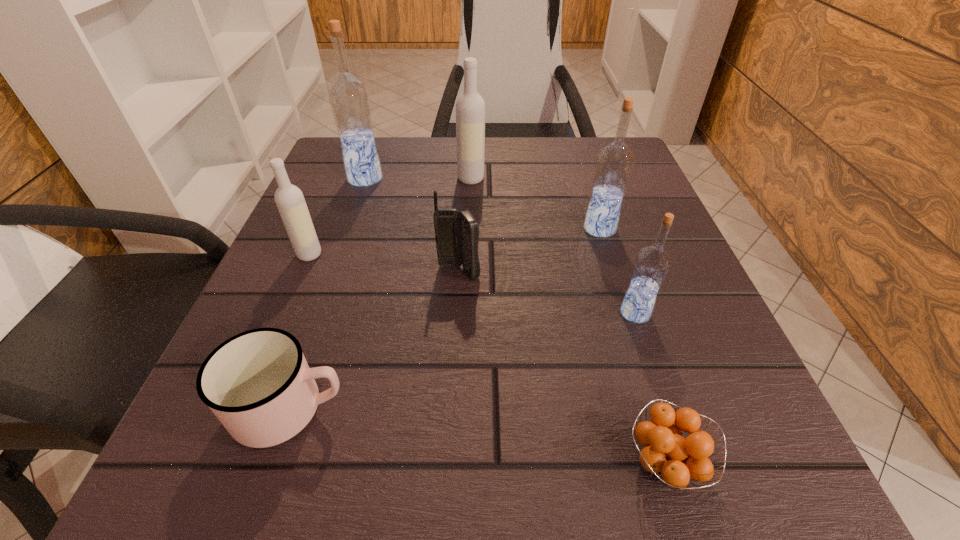
This screenshot has width=960, height=540. I want to click on unoccupied position between the second nearest vodka and the shortest object, so click(488, 359).

The height and width of the screenshot is (540, 960). Identify the location of blank region between the cellular telephone and the sixth nearest object. (529, 251).

This screenshot has height=540, width=960. Find the location of `object that stands as the seventh closest to the bigger white vodka`. object that stands as the seventh closest to the bigger white vodka is located at coordinates (673, 459).

Locate which object is the closest to the orange fruit. Please provide its 2D coordinates. Your answer should be formatted as a tuple, i.e. [(x, y)], where the tuple contains the x and y coordinates of a point satisfying the conditions above.

[(652, 263)]

The width and height of the screenshot is (960, 540). In order to click on vodka that is the third closest to the third vodka from left to right in this screenshot , I will do `click(289, 199)`.

Locate an element on the screen. vodka that is the second closest to the fourth farthest vodka is located at coordinates (470, 107).

Identify the location of blue vodka that is the closest to the leftmost blue vodka. This screenshot has height=540, width=960. (614, 163).

Select which blue vodka appears as the second closest to the third nearest object. Please provide its 2D coordinates. Your answer should be formatted as a tuple, i.e. [(x, y)], where the tuple contains the x and y coordinates of a point satisfying the conditions above.

[(349, 99)]

The image size is (960, 540). Find the location of `free space in the image that satisfies the following two spatial constraints: 1. on the keyboard of the nearest vodka; 2. on the left side of the sixth tallest object`. free space in the image that satisfies the following two spatial constraints: 1. on the keyboard of the nearest vodka; 2. on the left side of the sixth tallest object is located at coordinates (457, 313).